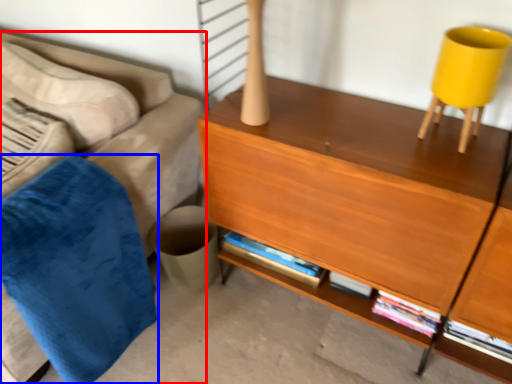
Question: Which object appears closest to the camera in this image, studio couch (highlighted by a red box) or blanket (highlighted by a blue box)?

Choices:
 (A) studio couch
 (B) blanket

Answer: (A)